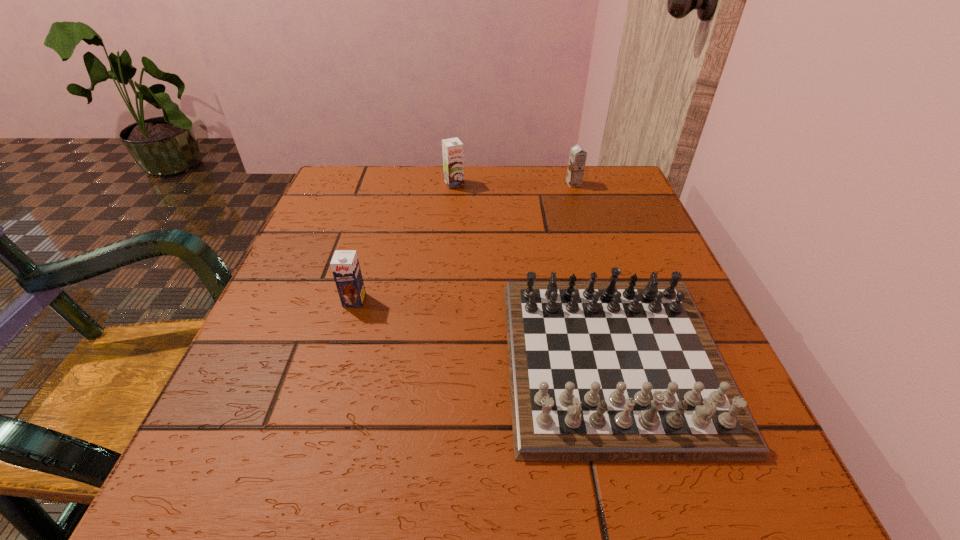
Find the location of a particular element. empty location between the third object from right to left and the rightmost chocolate milk is located at coordinates (514, 184).

The width and height of the screenshot is (960, 540). In order to click on free space between the rightmost chocolate milk and the nearest chocolate milk in this screenshot , I will do `click(464, 242)`.

The width and height of the screenshot is (960, 540). Find the location of `empty space between the leftmost chocolate milk and the second object from left to right`. empty space between the leftmost chocolate milk and the second object from left to right is located at coordinates (404, 242).

You are a GUI agent. You are given a task and a screenshot of the screen. Output one action in this format:
    pyautogui.click(x=<x>, y=<y>)
    Task: Click on the free spot between the second chocolate milk from right to left and the rightmost chocolate milk
    
    Given the screenshot: What is the action you would take?
    click(x=514, y=184)

You are a GUI agent. You are given a task and a screenshot of the screen. Output one action in this format:
    pyautogui.click(x=<x>, y=<y>)
    Task: Click on the free space that is in between the shortest object and the second object from left to right
    Image resolution: width=960 pixels, height=540 pixels.
    Given the screenshot: What is the action you would take?
    pyautogui.click(x=534, y=272)

What are the coordinates of `vacant space in between the rightmost chocolate milk and the leftmost chocolate milk` in the screenshot? It's located at (464, 242).

The height and width of the screenshot is (540, 960). Find the location of `free space between the nearest chocolate milk and the chessboard`. free space between the nearest chocolate milk and the chessboard is located at coordinates (484, 329).

I want to click on vacant point located between the rightmost chocolate milk and the second object from left to right, so click(x=514, y=184).

Locate an element on the screen. object that ranks as the second closest to the leftmost chocolate milk is located at coordinates (453, 162).

Identify which object is located as the nearest to the second object from left to right. Please provide its 2D coordinates. Your answer should be formatted as a tuple, i.e. [(x, y)], where the tuple contains the x and y coordinates of a point satisfying the conditions above.

[(577, 160)]